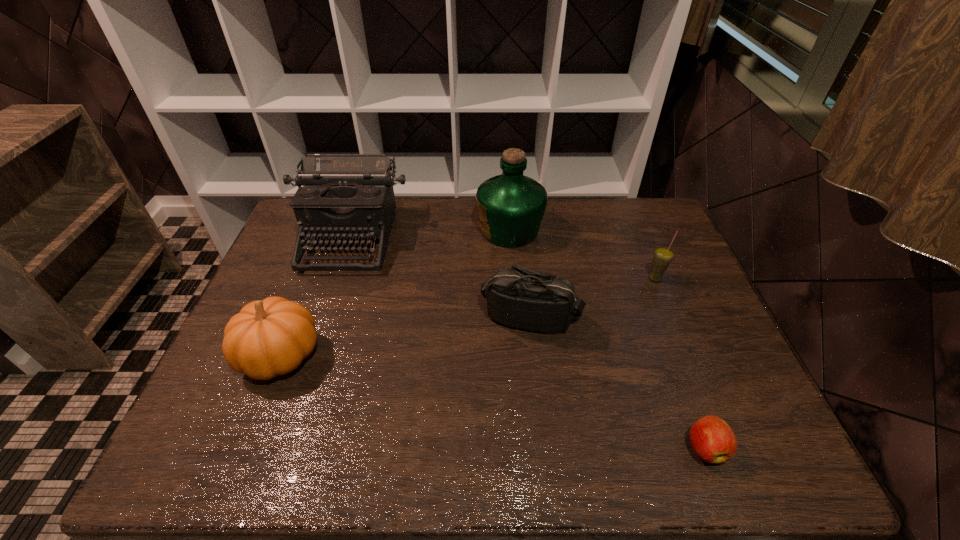
Where is `free area in between the shoulder bag and the pumpkin`? The width and height of the screenshot is (960, 540). free area in between the shoulder bag and the pumpkin is located at coordinates (406, 336).

This screenshot has width=960, height=540. In order to click on free area in between the pumpkin and the tallest object in this screenshot , I will do `click(396, 293)`.

What are the coordinates of `free space between the typewriter and the tallest object` in the screenshot? It's located at (430, 234).

Identify the location of free space between the liquor and the typewriter. (430, 234).

Locate an element on the screen. This screenshot has height=540, width=960. vacant area that lies between the straw for drinking and the apple is located at coordinates (681, 363).

Identify the location of vacant space in between the straw for drinking and the pumpkin. (468, 317).

Identify the location of vacant space in between the shoulder bag and the typewriter. Image resolution: width=960 pixels, height=540 pixels. (441, 278).

This screenshot has height=540, width=960. In order to click on vacant space in between the straw for drinking and the apple in this screenshot , I will do `click(681, 363)`.

Find the location of a particular element. This screenshot has width=960, height=540. free space between the straw for drinking and the pumpkin is located at coordinates (468, 317).

Choose which object is the nearest neighbor to the tallest object. Please provide its 2D coordinates. Your answer should be formatted as a tuple, i.e. [(x, y)], where the tuple contains the x and y coordinates of a point satisfying the conditions above.

[(518, 297)]